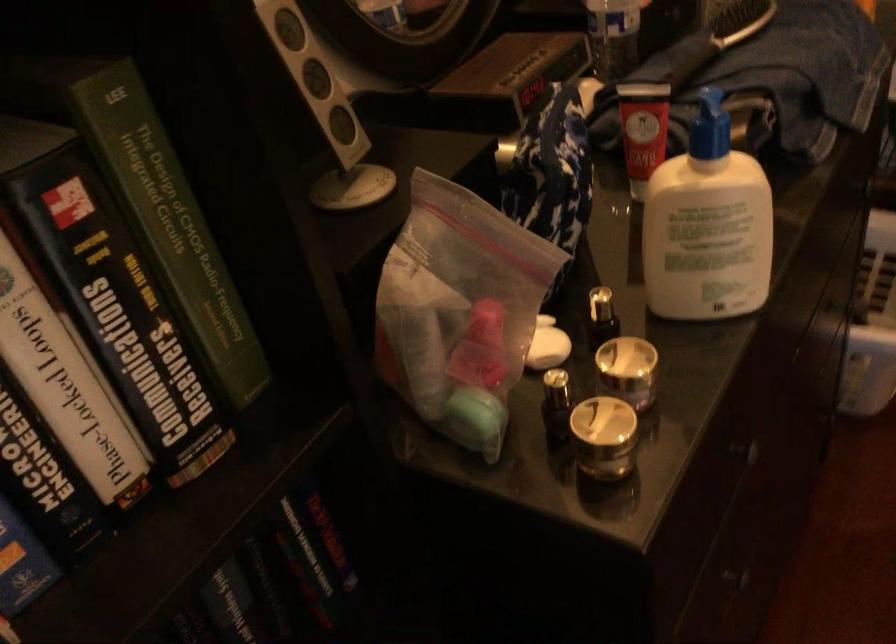
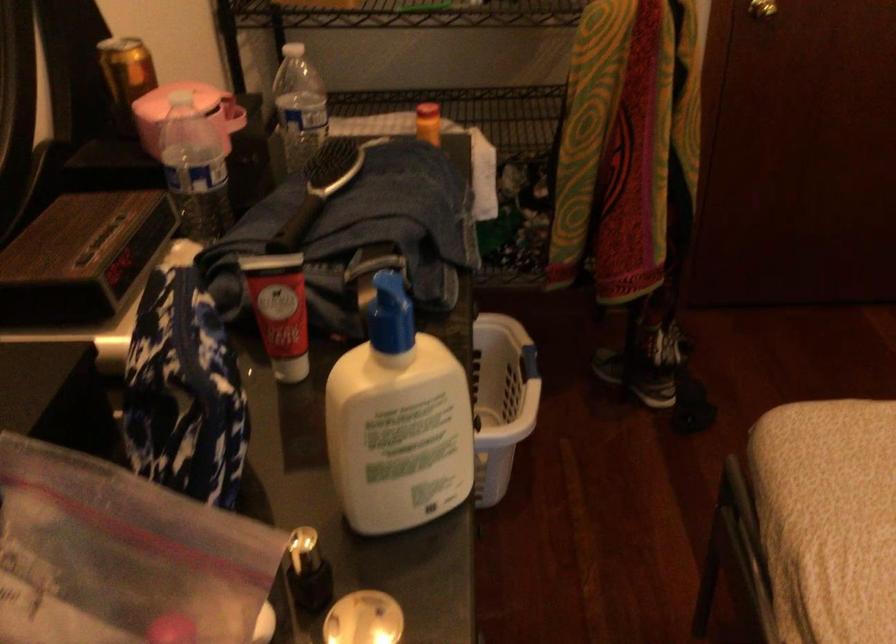
Find the pixel in the second image that matches point 643,131 in the first image.

(280, 310)